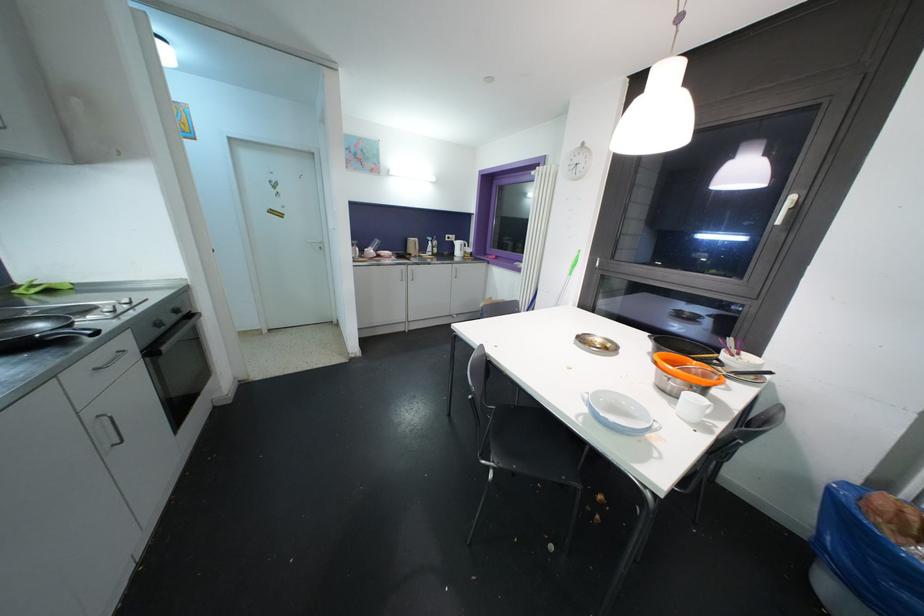
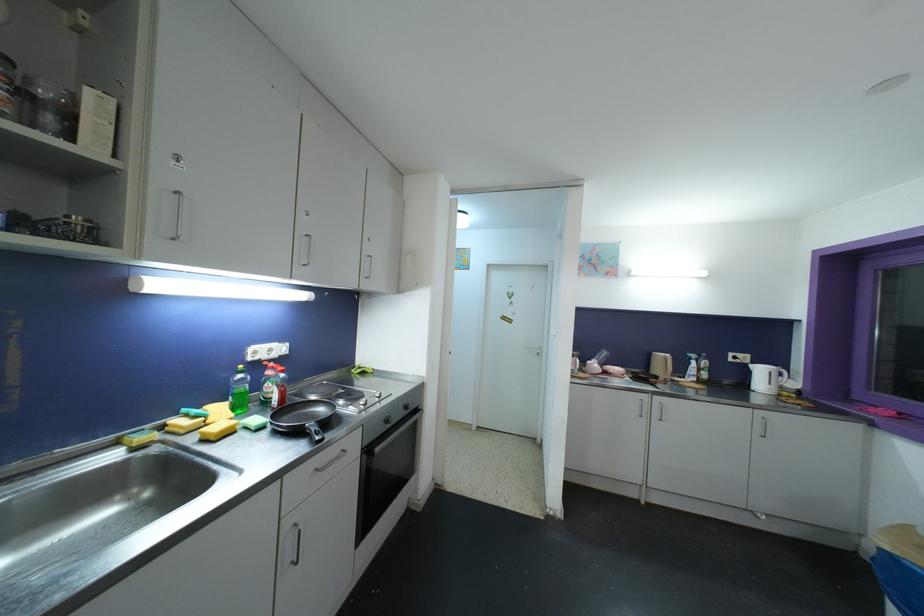
Where in the second image is the point corresponding to pixel 324 251 from the first image?

(542, 357)